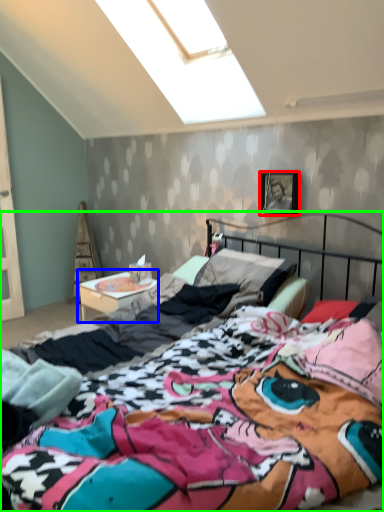
Question: Estimate the real-world distances between objects in this image. Which object is farther from picture frame (highlighted by a red box), nightstand (highlighted by a blue box) or bed (highlighted by a green box)?

Choices:
 (A) nightstand
 (B) bed

Answer: (B)